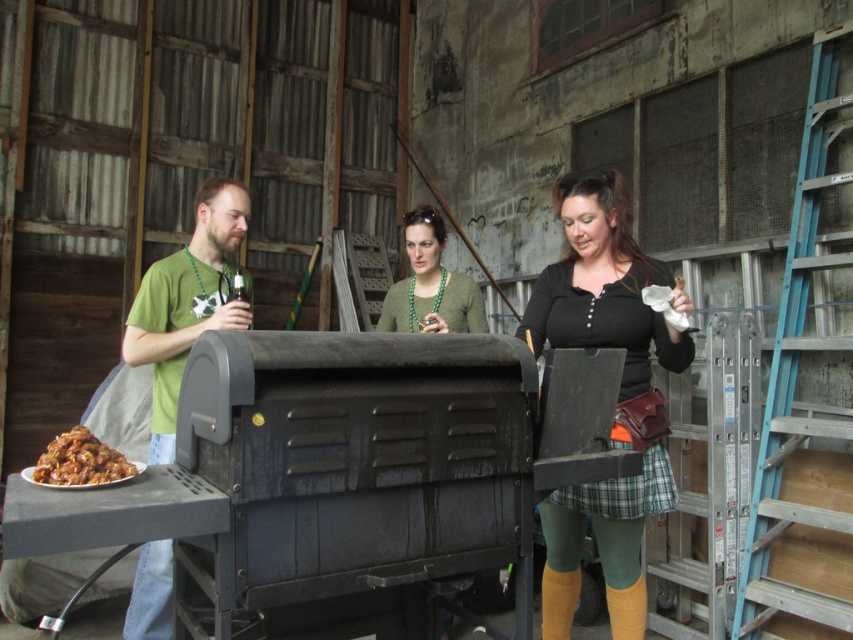
You are standing at the entrance of the building and want to reach the green beaded necklace at center without touching the blue metallic ladder at right. Is this possible?

The blue metallic ladder at right is positioned under the green beaded necklace at center, so you would need to step over or around the ladder to avoid touching it while reaching the necklace.

You are a photographer standing 5 feet away from the green matte shirt at left and the matte green sweater at center. Can you fit both in your camera frame if your camera has a 24mm lens which can capture a width of 30 inches?

The distance between the green matte shirt at left and the matte green sweater at center is 30.22 inches. Since the camera can capture 30 inches, the 0.22 inches difference means the two objects are slightly wider than the camera can capture. Therefore, you might need to adjust your position or use a wider lens to include both in the frame.

You are a photographer at the event and want to capture both the green plaid skirt at center and the brown glossy meat at lower left in the same frame. Given their sizes, which object will appear larger in the photo?

The green plaid skirt at center will appear larger in the photo because it is bigger than the brown glossy meat at lower left according to the description.